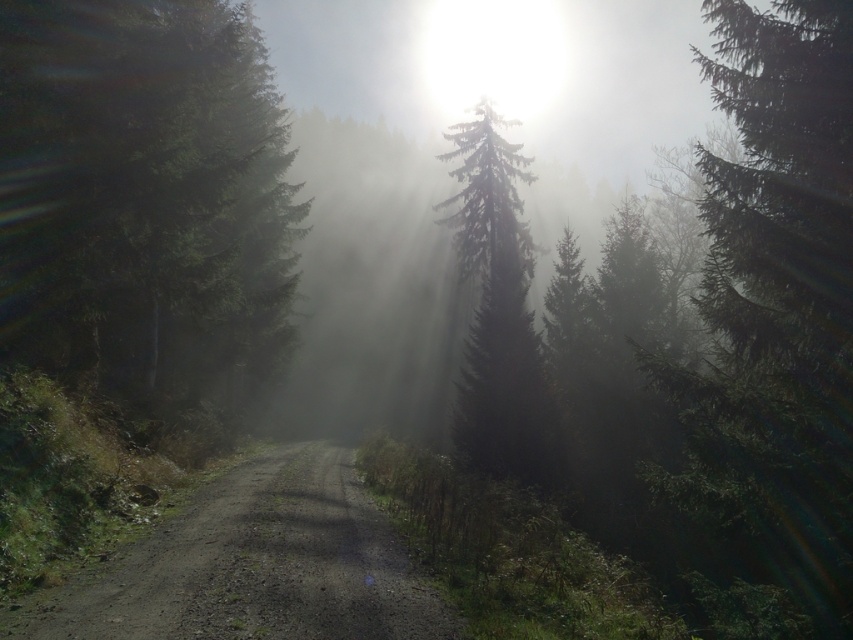
Question: Estimate the real-world distances between objects in this image. Which object is farther from the green matte tree at left?

Choices:
 (A) dirt/gravel road at center
 (B) green matte tree at center

Answer: (A)

Question: Does green matte tree at left have a lesser width compared to dirt/gravel road at center?

Choices:
 (A) yes
 (B) no

Answer: (B)

Question: Is dirt/gravel road at center above green matte tree at center?

Choices:
 (A) no
 (B) yes

Answer: (A)

Question: Considering the real-world distances, which object is farthest from the green matte tree at center?

Choices:
 (A) green matte tree at left
 (B) dirt/gravel road at center

Answer: (B)

Question: Which object is closer to the camera taking this photo?

Choices:
 (A) dirt/gravel road at center
 (B) green matte tree at center
 (C) green matte tree at left

Answer: (A)

Question: Does green matte tree at left have a larger size compared to green matte tree at center?

Choices:
 (A) no
 (B) yes

Answer: (A)